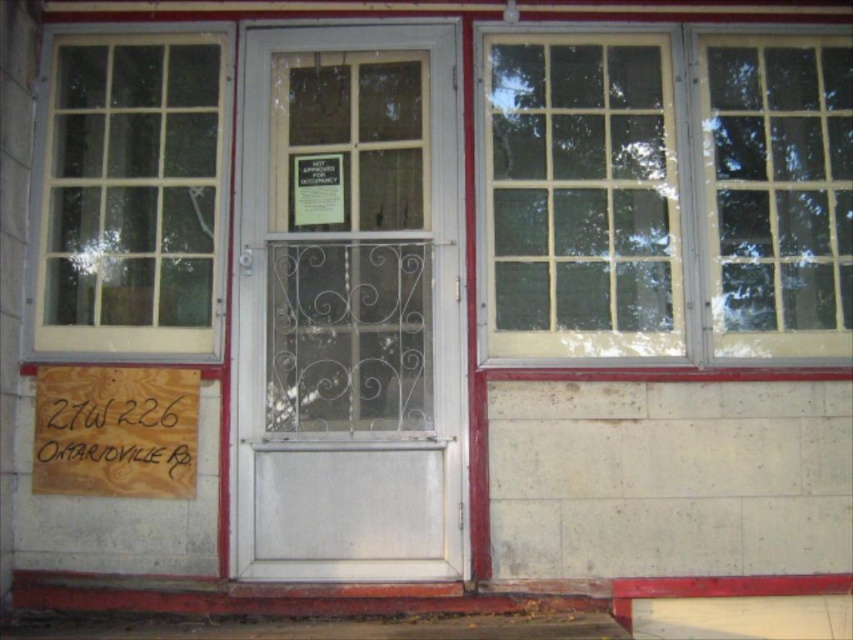
You are standing in front of the building and want to take a photo of the signboard with the address. The signboard is located at point (602,184). There is also a decorative metal grille at point (107,125). To ensure both the signboard and the grille are in focus, which point should be your focus point?

Point (602,184) is closer to the camera than point (107,125). To have both in focus, focus on the farther point, which is point (107,125), as it will include the closer object in the depth of field.

You are standing in front of the building and want to locate the matte glass window at left. According to the coordinates provided, where exactly is it positioned?

The matte glass window at left is positioned at coordinates point (132, 195).

You are standing in front of the building and want to enter through the door. Is the matte gray door at center blocking your view of the matte glass window at left?

Yes, the matte gray door at center is in front of the matte glass window at left, so it blocks the view of the matte glass window at left.